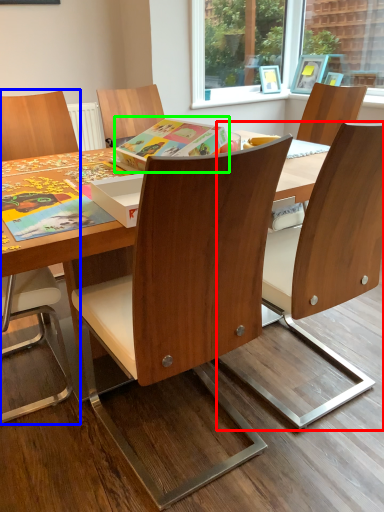
Question: Which is nearer to the chair (highlighted by a red box)? chair (highlighted by a blue box) or book (highlighted by a green box).

Choices:
 (A) chair
 (B) book

Answer: (B)